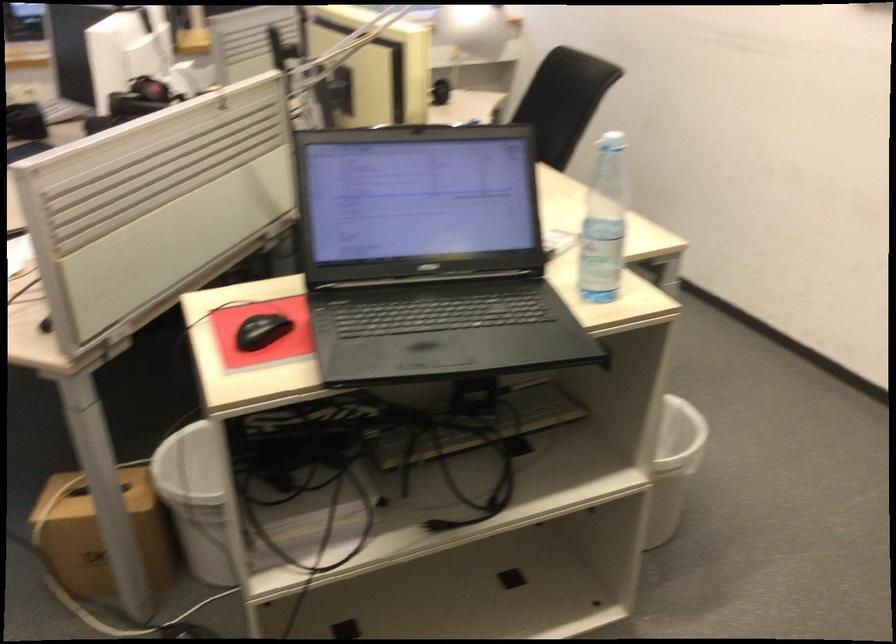
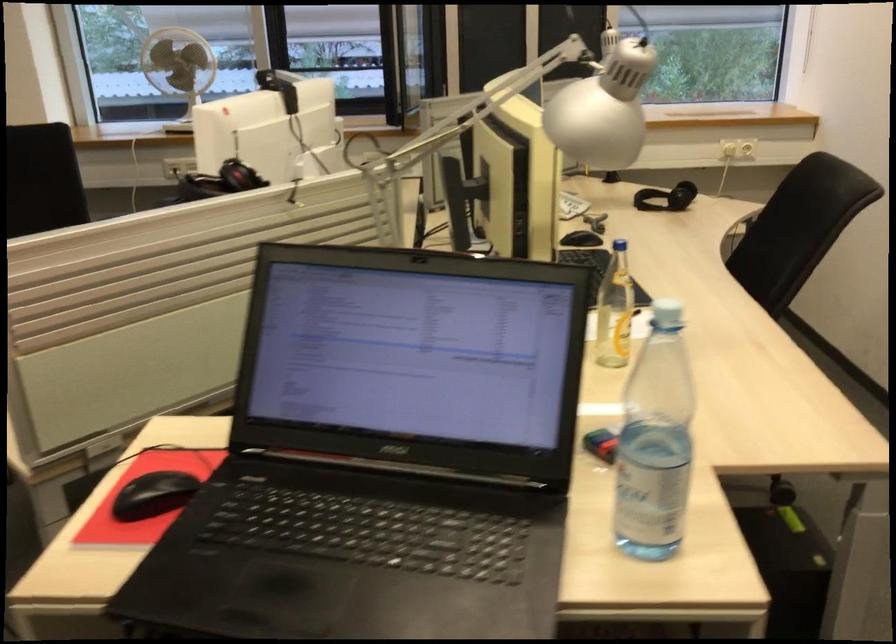
In the second image, find the point that corresponds to point 265,328 in the first image.

(153, 495)